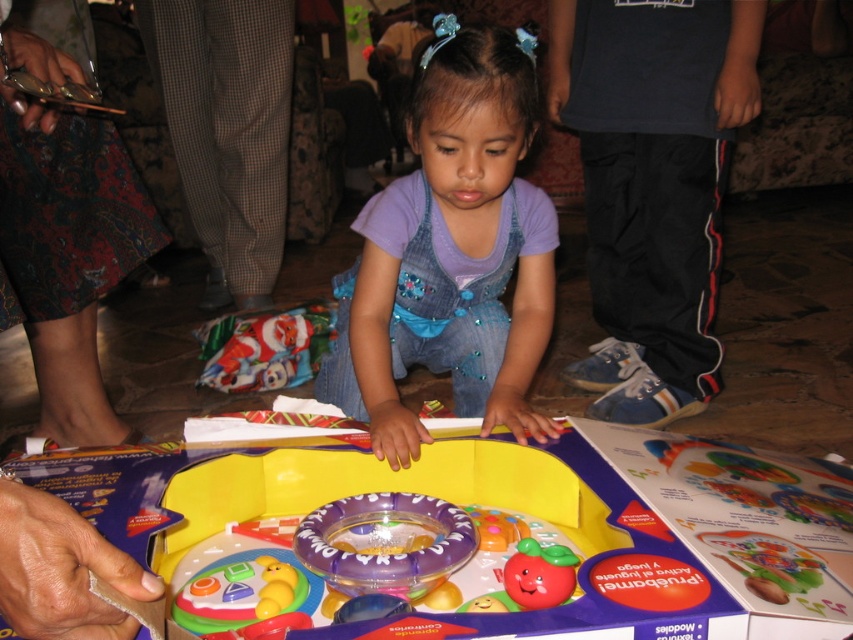
Question: Is printed fabric skirt at lower left above santa claus wrapping paper at lower center?

Choices:
 (A) yes
 (B) no

Answer: (A)

Question: Which of the following is the farthest from the observer?

Choices:
 (A) plastic toy at center
 (B) rubber apple at center
 (C) santa claus wrapping paper at lower center
 (D) denim overalls at center

Answer: (C)

Question: Among these points, which one is nearest to the camera?

Choices:
 (A) (444, 35)
 (B) (36, 336)
 (C) (799, 532)
 (D) (273, 346)

Answer: (C)

Question: Among these objects, which one is nearest to the camera?

Choices:
 (A) plastic toy at center
 (B) rubber apple at center
 (C) printed fabric skirt at lower left

Answer: (A)

Question: Is denim overalls at center in front of rubber apple at center?

Choices:
 (A) no
 (B) yes

Answer: (A)

Question: Does plastic toy at center have a larger size compared to denim overalls at center?

Choices:
 (A) yes
 (B) no

Answer: (B)